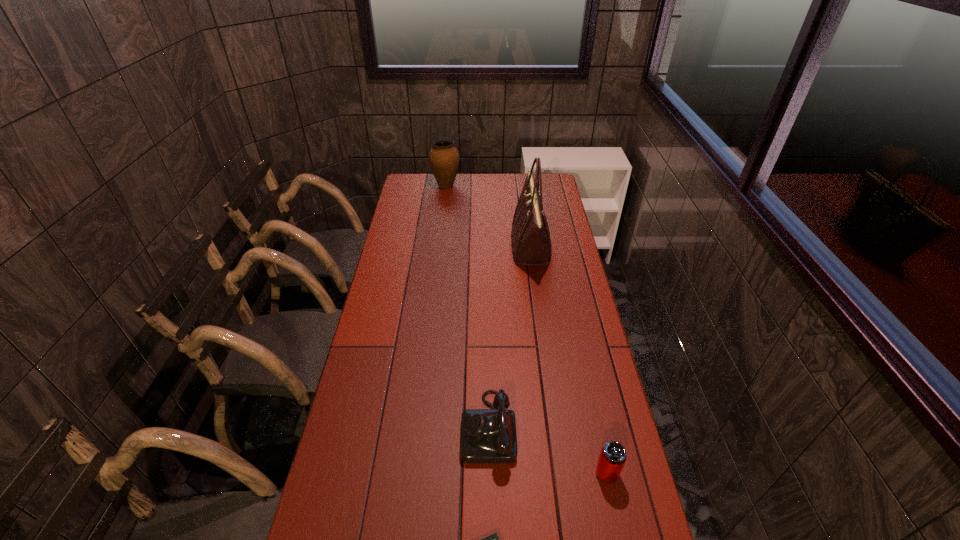
You are a GUI agent. You are given a task and a screenshot of the screen. Output one action in this format:
    pyautogui.click(x=<x>, y=<y>)
    Task: Click on the tallest object
    The image size is (960, 540).
    Given the screenshot: What is the action you would take?
    pyautogui.click(x=530, y=237)

Where is `the fourth nearest object`? Image resolution: width=960 pixels, height=540 pixels. the fourth nearest object is located at coordinates (530, 237).

The image size is (960, 540). What are the coordinates of `urn` in the screenshot? It's located at click(x=444, y=158).

The image size is (960, 540). I want to click on the leftmost object, so click(x=444, y=158).

Find the location of `soda can`. soda can is located at coordinates (612, 458).

What are the coordinates of `telephone` in the screenshot? It's located at (487, 435).

Locate an element on the screen. This screenshot has height=540, width=960. free space located on the front-facing side of the tallest object is located at coordinates (433, 247).

What are the coordinates of `vacant region located 0.120m on the front-facing side of the tallest object` in the screenshot? It's located at (484, 247).

You are a GUI agent. You are given a task and a screenshot of the screen. Output one action in this format:
    pyautogui.click(x=<x>, y=<y>)
    Task: Click on the vacant region located 0.370m on the front-facing side of the tallest object
    The width and height of the screenshot is (960, 540).
    Given the screenshot: What is the action you would take?
    point(426,247)

Locate an element on the screen. The width and height of the screenshot is (960, 540). vacant space located 0.120m on the left of the fourth shortest object is located at coordinates (408, 186).